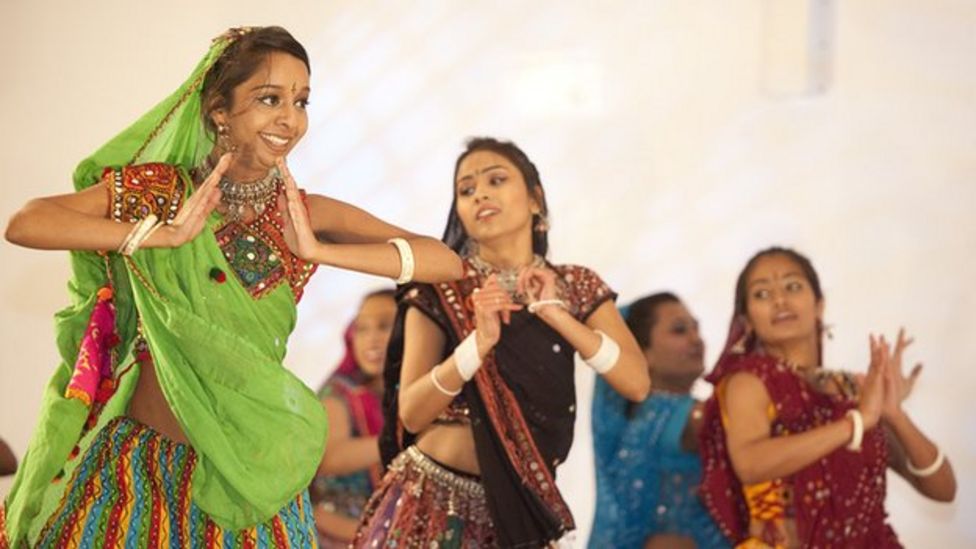
The image size is (976, 549). I want to click on the largest and brightest reflection on wall, so click(555, 86).